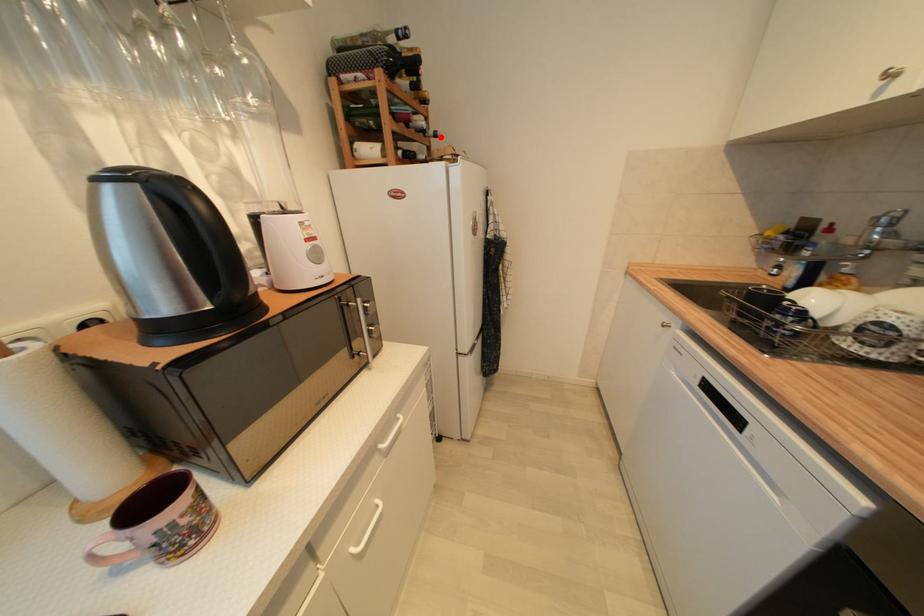
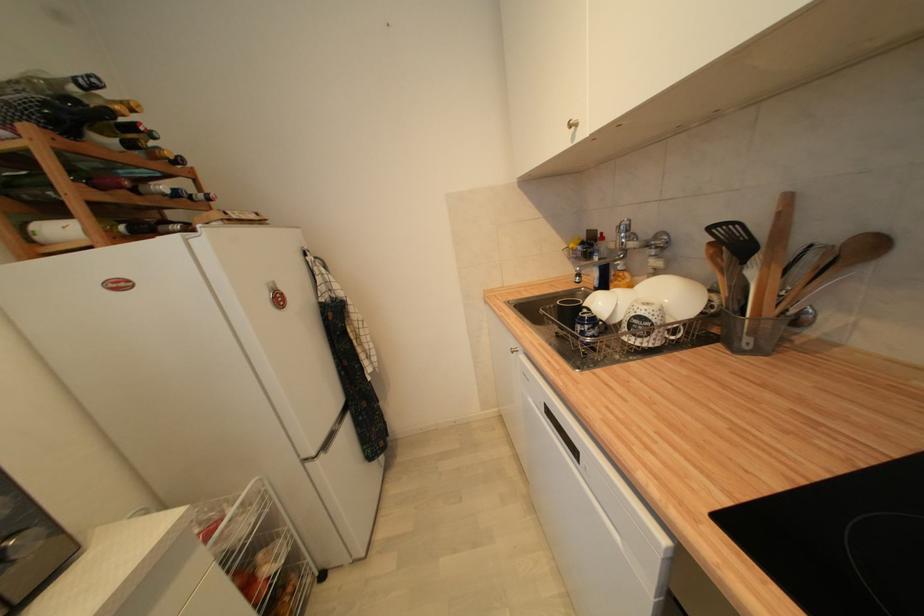
In the second image, find the point that corresponds to the highlighted location in the first image.

(213, 200)